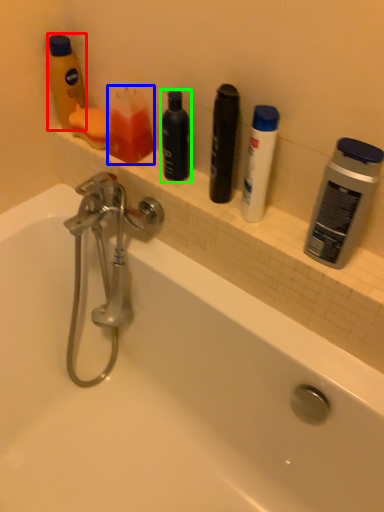
Question: Which object is the farthest from toiletry (highlighted by a red box)? Choose among these: toiletry (highlighted by a blue box) or personal care (highlighted by a green box).

Choices:
 (A) toiletry
 (B) personal care

Answer: (B)